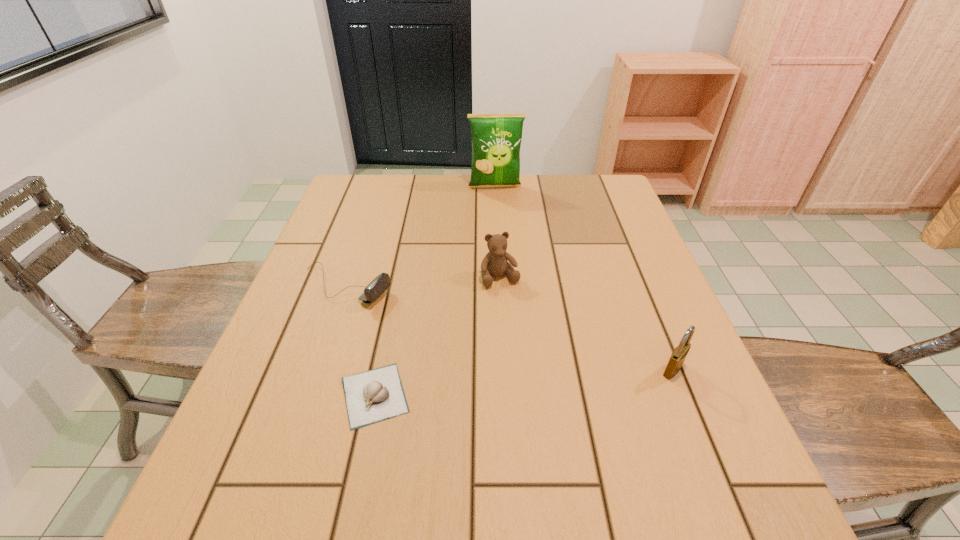
The width and height of the screenshot is (960, 540). I want to click on free space located on the front-facing side of the second shortest object, so click(486, 339).

Locate an element on the screen. The width and height of the screenshot is (960, 540). vacant area situated 0.110m on the front-facing side of the tallest object is located at coordinates (499, 211).

The width and height of the screenshot is (960, 540). In order to click on blank space located 0.200m on the front-facing side of the tallest object in this screenshot , I will do `click(501, 228)`.

Identify the location of vacant area situated on the front-facing side of the tallest object. The height and width of the screenshot is (540, 960). (500, 216).

Find the location of a particular element. The height and width of the screenshot is (540, 960). free location located 0.100m on the front-facing side of the teddy bear is located at coordinates (517, 319).

Locate an element on the screen. vacant space located 0.220m on the front-facing side of the teddy bear is located at coordinates (535, 361).

This screenshot has height=540, width=960. I want to click on free space located 0.130m on the front-facing side of the teddy bear, so pos(521,329).

Where is `object at the far edge`? object at the far edge is located at coordinates (496, 138).

Locate an element on the screen. The height and width of the screenshot is (540, 960). object that is at the near edge is located at coordinates (376, 395).

Find the location of a particular element. object that is at the left edge is located at coordinates (381, 283).